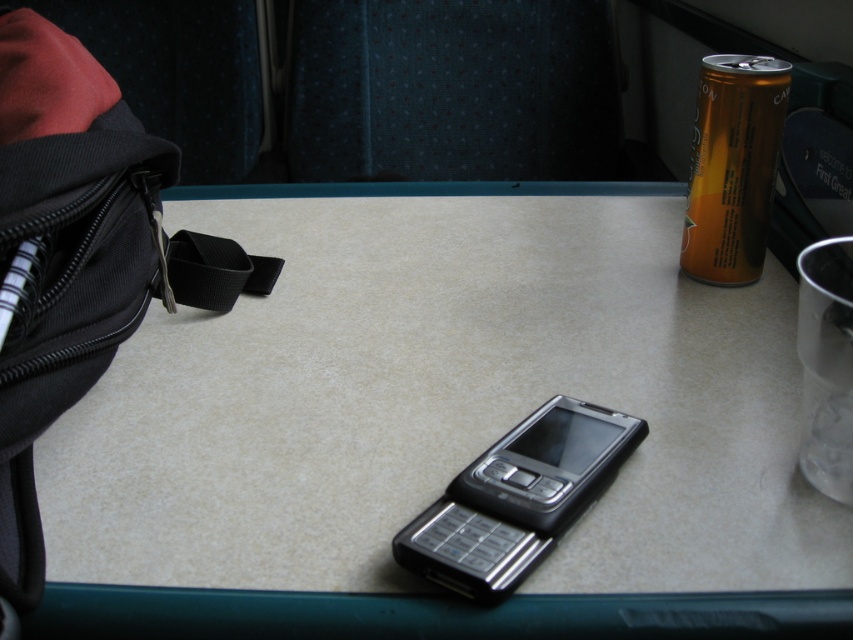
What do you see at coordinates (78, 257) in the screenshot?
I see `black fabric bag at left` at bounding box center [78, 257].

Who is lower down, black fabric bag at left or silver metallic smartphone at center?

silver metallic smartphone at center

The image size is (853, 640). Identify the location of black fabric bag at left. (78, 257).

From the picture: Is matte plastic phone at center taller than orange aluminum can at upper right?

Correct, matte plastic phone at center is much taller as orange aluminum can at upper right.

How much distance is there between matte plastic phone at center and orange aluminum can at upper right?

matte plastic phone at center and orange aluminum can at upper right are 9.73 inches apart.

Which is behind, point (341, 193) or point (695, 134)?

Positioned behind is point (341, 193).

Locate an element on the screen. matte plastic phone at center is located at coordinates (440, 401).

Can you confirm if matte plastic phone at center is positioned to the right of silver metallic smartphone at center?

No, matte plastic phone at center is not to the right of silver metallic smartphone at center.

Which is more to the right, matte plastic phone at center or silver metallic smartphone at center?

silver metallic smartphone at center is more to the right.

Who is more distant from viewer, (357, 250) or (512, 470)?

Positioned behind is point (357, 250).

The height and width of the screenshot is (640, 853). I want to click on matte plastic phone at center, so click(x=440, y=401).